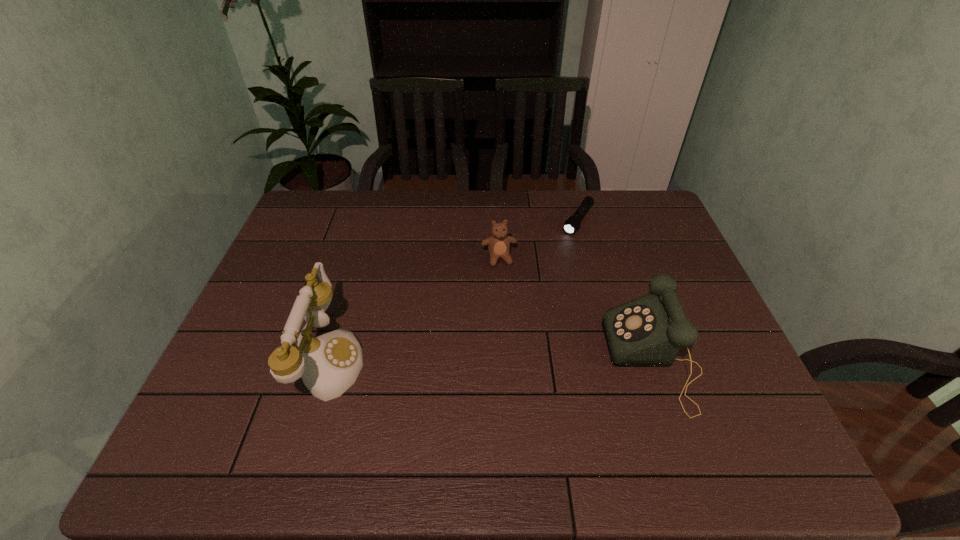
At what (x,y) coordinates should I click in order to perform the action: click on vacant point located between the taller telephone and the teddy bear. Please return your answer as a coordinate pair (x, y). Image resolution: width=960 pixels, height=540 pixels. Looking at the image, I should click on (414, 309).

The image size is (960, 540). I want to click on vacant space that's between the shorter telephone and the tallest object, so click(491, 360).

You are a GUI agent. You are given a task and a screenshot of the screen. Output one action in this format:
    pyautogui.click(x=<x>, y=<y>)
    Task: Click on the vacant space in between the right telephone and the shortest object
    This screenshot has height=540, width=960.
    Given the screenshot: What is the action you would take?
    pyautogui.click(x=615, y=290)

Locate an element on the screen. vacant area that lies between the shorter telephone and the flashlight is located at coordinates (615, 290).

The height and width of the screenshot is (540, 960). I want to click on free area in between the third tallest object and the shortest object, so click(x=539, y=239).

What are the coordinates of `free area in between the farthest object and the second farthest object` in the screenshot? It's located at (539, 239).

You are a GUI agent. You are given a task and a screenshot of the screen. Output one action in this format:
    pyautogui.click(x=<x>, y=<y>)
    Task: Click on the free spot between the taller telephone and the shortest object
    This screenshot has width=960, height=540.
    Given the screenshot: What is the action you would take?
    pyautogui.click(x=453, y=290)

Locate an element on the screen. This screenshot has height=540, width=960. vacant area that lies between the second farthest object and the shorter telephone is located at coordinates (576, 309).

Identify which object is the second closest to the leftmost object. Please provide its 2D coordinates. Your answer should be formatted as a tuple, i.e. [(x, y)], where the tuple contains the x and y coordinates of a point satisfying the conditions above.

[(646, 332)]

Identify which object is the closest to the third object from right to left. Please provide its 2D coordinates. Your answer should be formatted as a tuple, i.e. [(x, y)], where the tuple contains the x and y coordinates of a point satisfying the conditions above.

[(572, 224)]